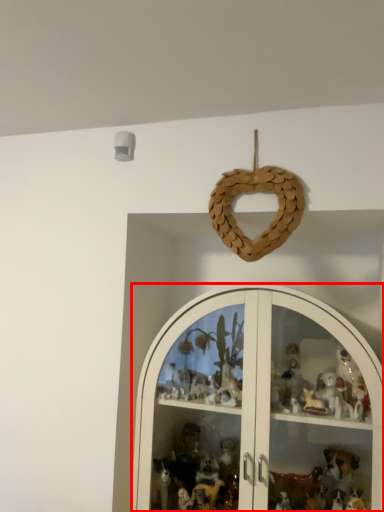
Question: In this image, where is shelf (annotated by the red box) located relative to toy?

Choices:
 (A) right
 (B) left

Answer: (A)